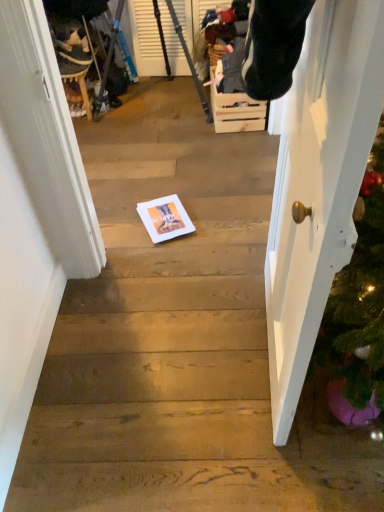
Find the location of a particular element. The height and width of the screenshot is (512, 384). vacant area situated to the left side of white glossy door at right is located at coordinates (169, 355).